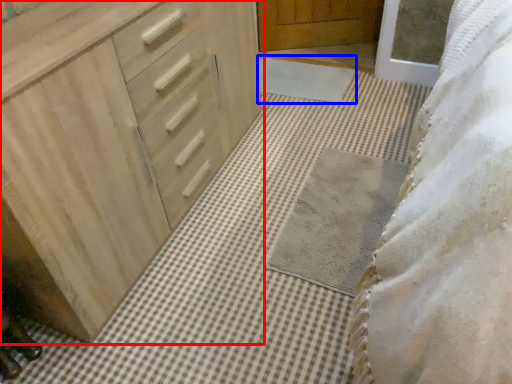
Question: Which object is closer to the camera taking this photo, chest of drawers (highlighted by a red box) or bath mat (highlighted by a blue box)?

Choices:
 (A) chest of drawers
 (B) bath mat

Answer: (A)